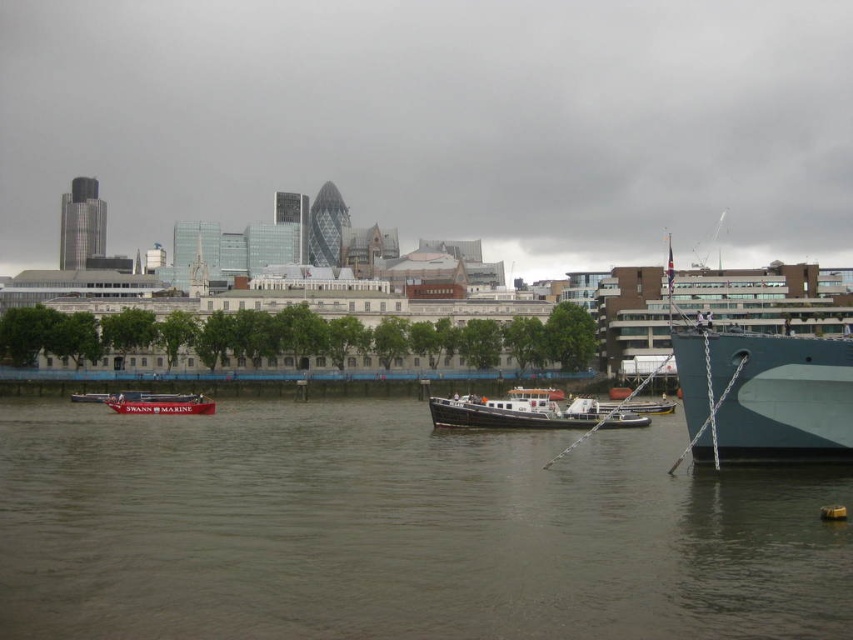
You are standing at the waterfront and want to take a photo of the black polished wood boat at center. If your camera can focus on objects up to 300 feet away, will you be able to capture a clear image of the boat?

The black polished wood boat at center is 275.10 feet away from camera, so yes, the camera can focus on it since the distance is within the 300 feet range.

You are a photographer planning to capture the waterfront scene. You want to ensure that the brown water at lower center and the red matte boat at center are both visible in your shot. Given their sizes, which object will occupy more of the frame?

The brown water at lower center occupies more of the frame because it is larger in size than the red matte boat at center.

You are standing at the waterfront and see the brown water at lower center and the red matte boat at center. Which object is closer to you?

The brown water at lower center is closer to you because it is in front of the red matte boat at center.